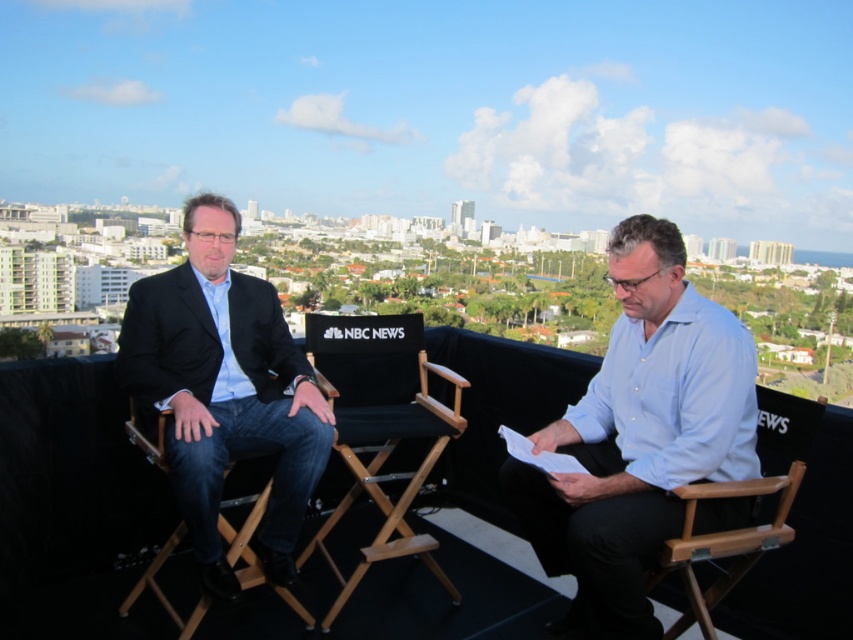
Question: Is black fabric chair at center to the right of wooden director's chair at left from the viewer's perspective?

Choices:
 (A) yes
 (B) no

Answer: (A)

Question: Is light blue shirt at center closer to the viewer compared to wooden director's chair at left?

Choices:
 (A) no
 (B) yes

Answer: (A)

Question: Is the position of wooden folding chair at right less distant than that of wooden director's chair at left?

Choices:
 (A) yes
 (B) no

Answer: (B)

Question: Which of these objects is positioned closest to the black fabric chair at center?

Choices:
 (A) wooden director's chair at left
 (B) matte black suit at left
 (C) light blue shirt at center

Answer: (B)

Question: Which is farther from the wooden director's chair at left?

Choices:
 (A) black fabric chair at center
 (B) matte black suit at left

Answer: (A)

Question: Which point is closer to the camera?

Choices:
 (A) (700, 538)
 (B) (231, 532)
 (C) (328, 385)

Answer: (A)